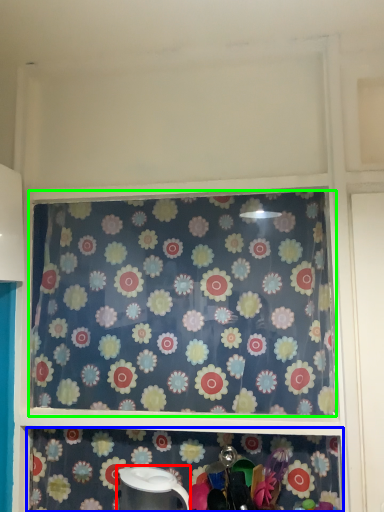
Question: Based on their relative distances, which object is nearer to appliance (highlighted by a red box)? Choose from shelf (highlighted by a blue box) and curtain (highlighted by a green box).

Choices:
 (A) shelf
 (B) curtain

Answer: (A)